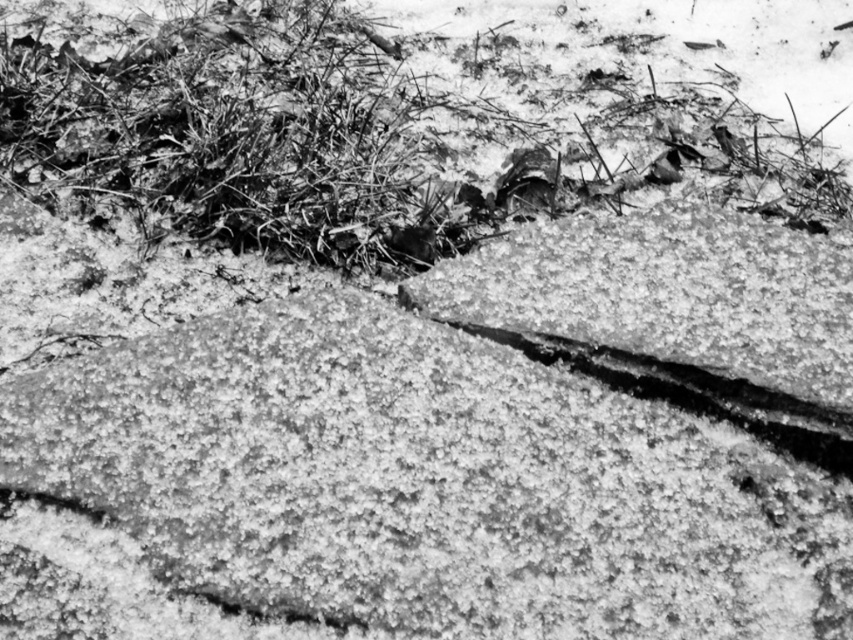
Is smooth gray rock at center to the left of coarse textured grass at upper center from the viewer's perspective?

Yes, smooth gray rock at center is to the left of coarse textured grass at upper center.

Based on the photo, which is above, smooth gray rock at center or coarse textured grass at upper center?

Positioned higher is coarse textured grass at upper center.

Identify the location of smooth gray rock at center. The width and height of the screenshot is (853, 640). (427, 483).

Where is `smooth gray rock at center`? The height and width of the screenshot is (640, 853). smooth gray rock at center is located at coordinates (427, 483).